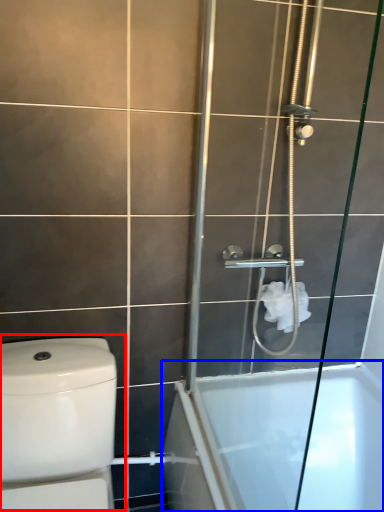
Question: Among these objects, which one is farthest to the camera, toilet (highlighted by a red box) or bathtub (highlighted by a blue box)?

Choices:
 (A) toilet
 (B) bathtub

Answer: (B)